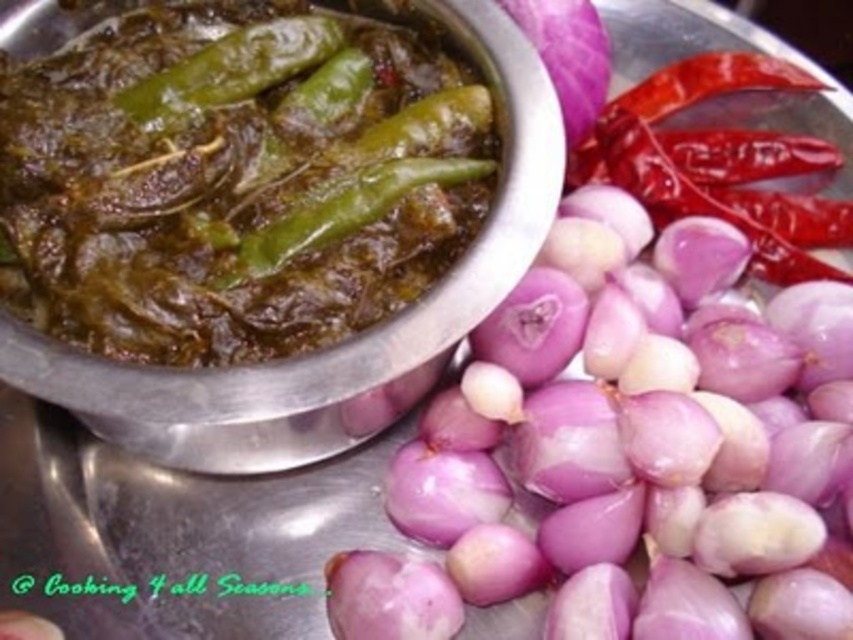
Looking at the culinary setup, there are two chilies present. The green matte chili pepper at center and the red matte chili pepper at upper right. Which one is positioned to the left of the other?

The green matte chili pepper at center is positioned to the left of the red matte chili pepper at upper right.

You are a chef preparing a dish and need to know which chili pepper is taller. Which one is taller between the green matte chili pepper at center and the red matte chili pepper at upper right?

The green matte chili pepper at center is taller than the red matte chili pepper at upper right.

You are a chef preparing a dish and need to place two ingredients on the table. The first ingredient is at point (210, 141), and the second is at point (717, 177). Which point is closer to you when standing at the edge of the table?

Point (210, 141) is closer to you because it is in front of point (717, 177).